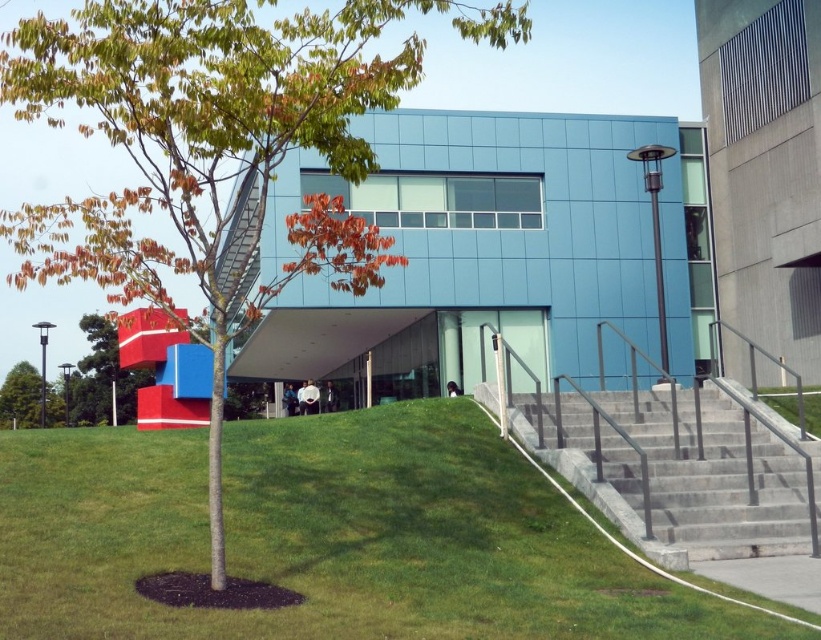
Based on the photo, you are standing at the entrance of the modern building with the blue facade. You want to plant a new tree exactly where the green leafy tree at center is currently located. However, you need to ensure that the new tree will not block the entrance. Based on the coordinates provided, will the new tree be positioned in a way that blocks the entrance?

The green leafy tree at center is located at coordinates point [214,150], which is at the center of the image. Since the entrance is at the center, planting the tree there would block the entrance.

You are standing at the entrance of the modern building and want to walk towards the green grassy area at lower left. Which object will you pass by first? The smooth red cube at left or the green grassy at lower left?

The green grassy at lower left is in front of the smooth red cube at left, so you will pass by the green grassy at lower left first before reaching the smooth red cube at left.